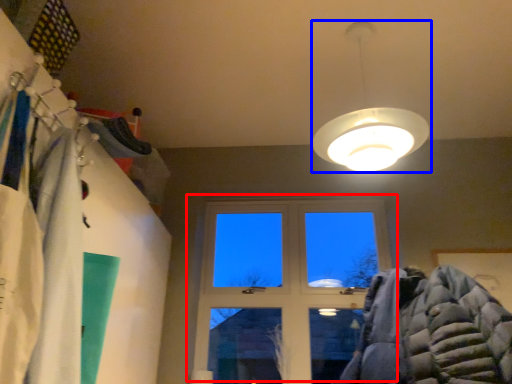
Question: Which object is further to the camera taking this photo, window (highlighted by a red box) or lamp (highlighted by a blue box)?

Choices:
 (A) window
 (B) lamp

Answer: (A)